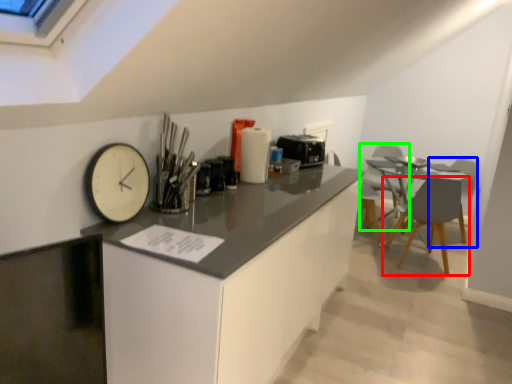
Question: Which object is the farthest from chair (highlighted by a red box)? Choose among these: armchair (highlighted by a blue box) or swivel chair (highlighted by a green box).

Choices:
 (A) armchair
 (B) swivel chair

Answer: (A)